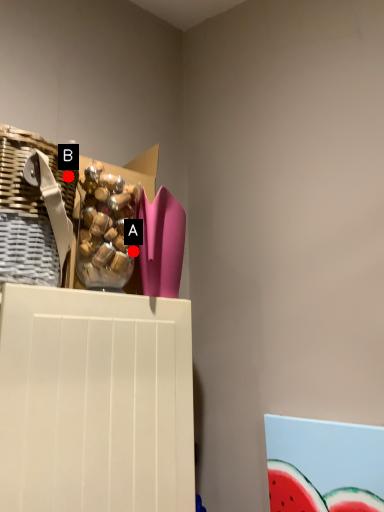
Question: Two points are circled on the image, labeled by A and B beside each circle. Which point is farther from the camera taking this photo?

Choices:
 (A) A is further
 (B) B is further

Answer: (A)